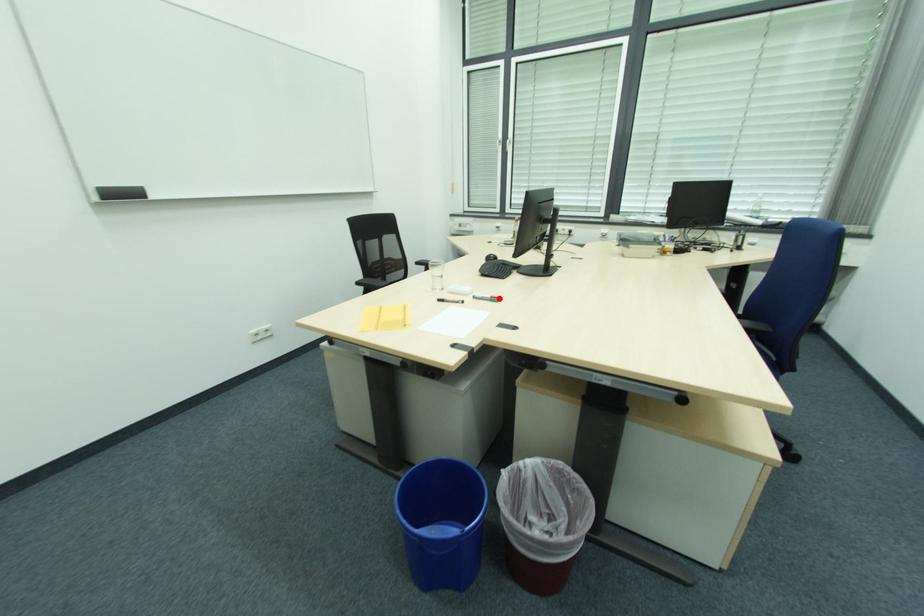
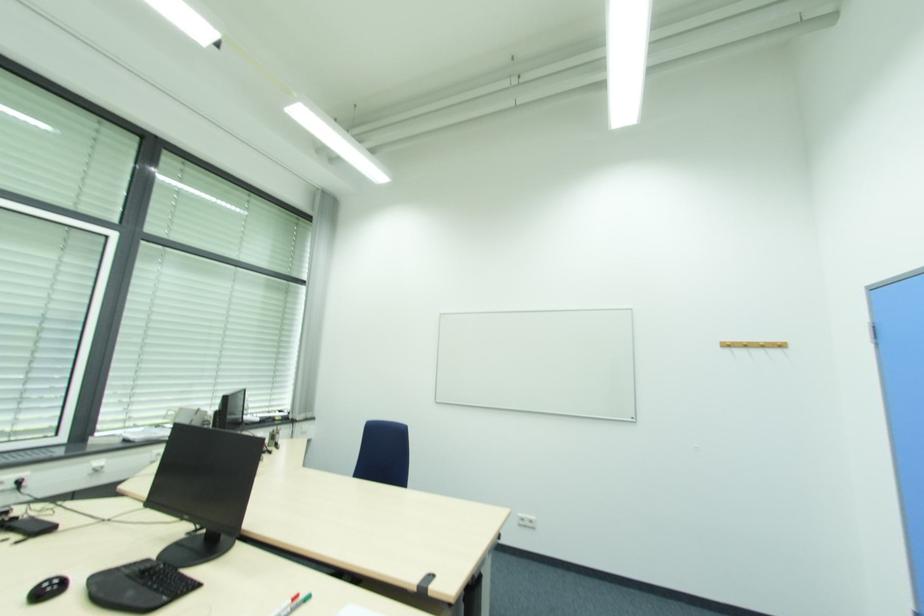
Locate, in the second image, the point that corresponds to the highlighted location in the first image.

(298, 599)